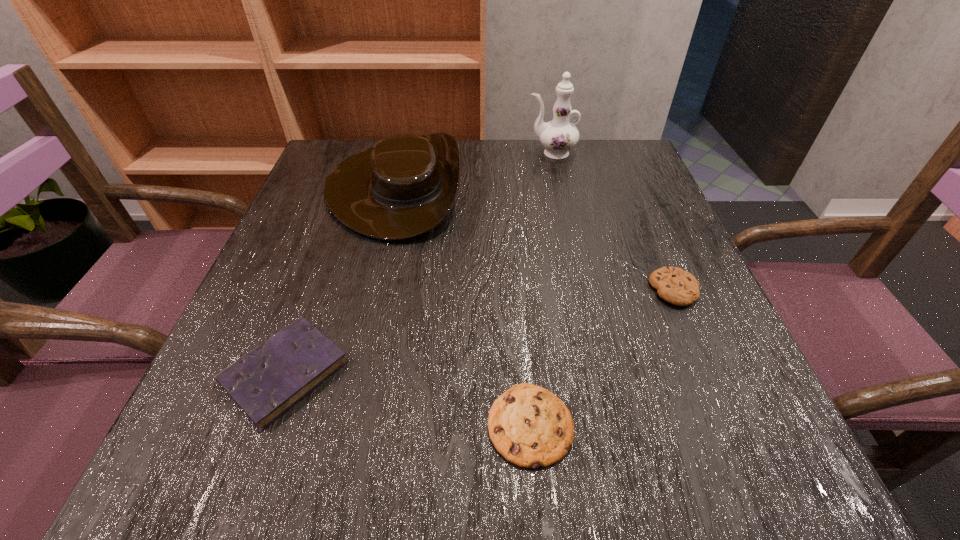
The width and height of the screenshot is (960, 540). Find the location of `chinaware located in the right edge section of the desktop`. chinaware located in the right edge section of the desktop is located at coordinates (558, 136).

What are the coordinates of `cookie located in the right edge section of the desktop` in the screenshot? It's located at (676, 286).

Where is `object that is at the far left corner`? object that is at the far left corner is located at coordinates (403, 187).

You are a GUI agent. You are given a task and a screenshot of the screen. Output one action in this format:
    pyautogui.click(x=<x>, y=<y>)
    Task: Click on the object located in the near left corner section of the desktop
    The width and height of the screenshot is (960, 540).
    Given the screenshot: What is the action you would take?
    pyautogui.click(x=266, y=382)

In order to click on object that is at the far right corner in this screenshot , I will do `click(558, 136)`.

The image size is (960, 540). In order to click on vacant space at the far edge of the desktop in this screenshot , I will do `click(534, 152)`.

In the image, there is a desktop. Where is `vacant space at the near edge`? This screenshot has width=960, height=540. vacant space at the near edge is located at coordinates (320, 477).

The height and width of the screenshot is (540, 960). I want to click on free space at the left edge of the desktop, so click(340, 284).

The width and height of the screenshot is (960, 540). Find the location of `vacant position at the right edge of the desktop`. vacant position at the right edge of the desktop is located at coordinates (610, 262).

The image size is (960, 540). What are the coordinates of `free location at the far left corner of the desktop` in the screenshot? It's located at (325, 151).